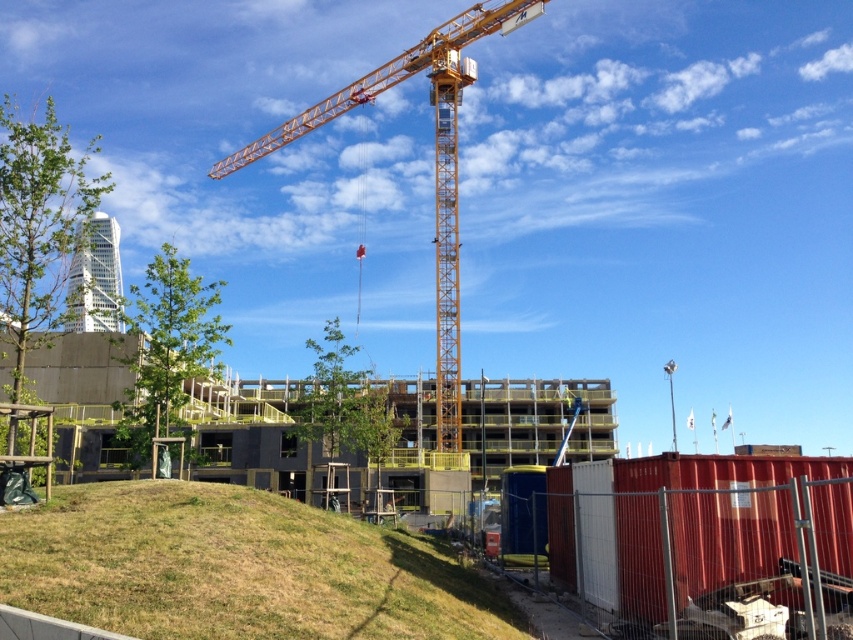
Which is more to the left, green grassy hill at lower left or yellow metallic crane at center?

From the viewer's perspective, yellow metallic crane at center appears more on the left side.

Between green grassy hill at lower left and yellow metallic crane at center, which one has more height?

Standing taller between the two is yellow metallic crane at center.

Who is more forward, (334,557) or (456,314)?

Point (334,557)

Identify the location of green grassy hill at lower left. The image size is (853, 640). (236, 568).